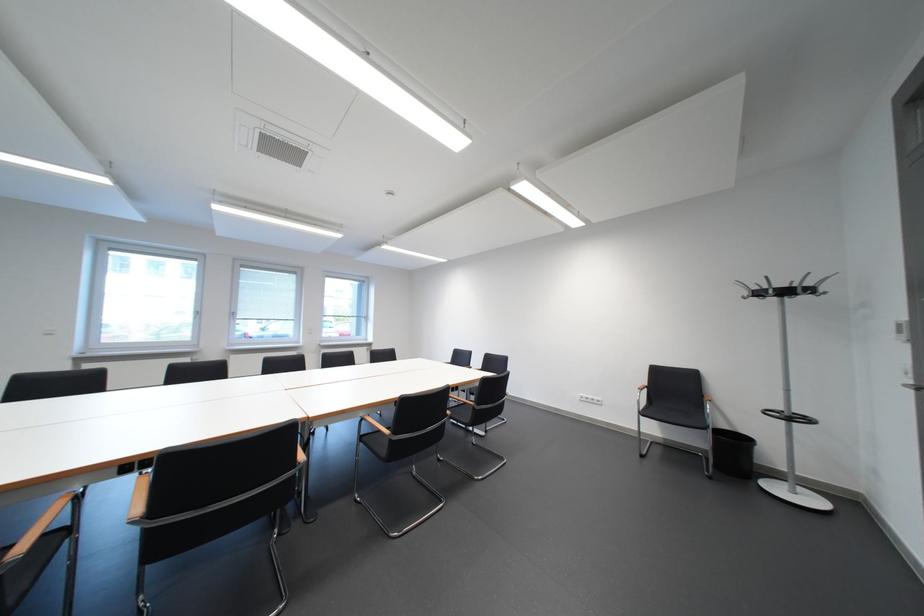
Describe the element at coordinates (784, 288) in the screenshot. I see `a metal coat hook` at that location.